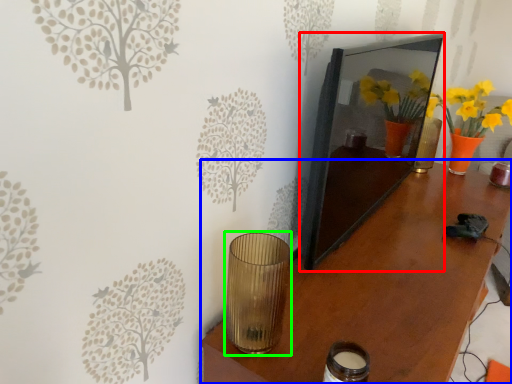
Question: Which object is the closest to the picture frame (highlighted by a red box)? Choose among these: table (highlighted by a blue box) or candle holder (highlighted by a green box).

Choices:
 (A) table
 (B) candle holder

Answer: (A)